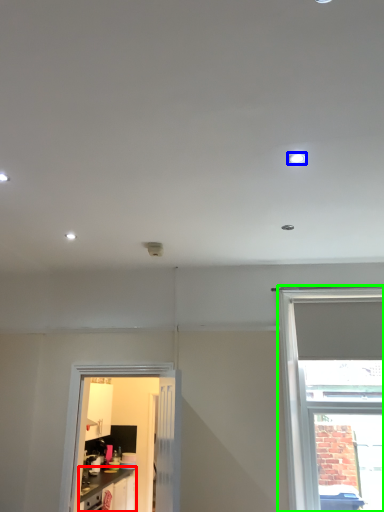
Question: Which object is positioned farthest from cabinetry (highlighted by a red box)? Select from lighting (highlighted by a blue box) and window (highlighted by a green box).

Choices:
 (A) lighting
 (B) window

Answer: (A)